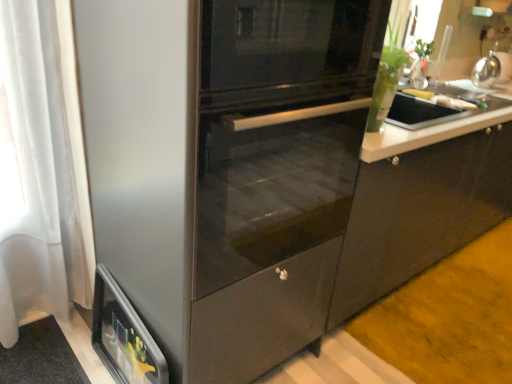
Question: Is yellow matte banana at upper right, the 1th food when ordered from back to front, not inside satin silver kettle at upper right?

Choices:
 (A) yes
 (B) no

Answer: (A)

Question: Does yellow matte banana at upper right, the 1th food when ordered from back to front, have a greater width compared to satin silver kettle at upper right?

Choices:
 (A) no
 (B) yes

Answer: (A)

Question: Is yellow matte banana at upper right, which is counted as the second food, starting from the front, beside satin silver kettle at upper right?

Choices:
 (A) yes
 (B) no

Answer: (B)

Question: From a real-world perspective, is yellow matte banana at upper right, the 1th food when ordered from back to front, positioned over satin silver kettle at upper right based on gravity?

Choices:
 (A) no
 (B) yes

Answer: (A)

Question: Considering the relative positions of yellow matte banana at upper right, which is counted as the second food, starting from the front, and satin silver kettle at upper right in the image provided, is yellow matte banana at upper right, which is counted as the second food, starting from the front, to the left of satin silver kettle at upper right from the viewer's perspective?

Choices:
 (A) yes
 (B) no

Answer: (A)

Question: Relative to stainless steel fridge at center, is metallic silver toaster at lower left in front or behind?

Choices:
 (A) behind
 (B) front

Answer: (A)

Question: In terms of size, does metallic silver toaster at lower left appear bigger or smaller than stainless steel fridge at center?

Choices:
 (A) small
 (B) big

Answer: (A)

Question: Do you think metallic silver toaster at lower left is within stainless steel fridge at center, or outside of it?

Choices:
 (A) inside
 (B) outside

Answer: (B)

Question: From a real-world perspective, is metallic silver toaster at lower left above or below stainless steel fridge at center?

Choices:
 (A) above
 (B) below

Answer: (B)

Question: From the image's perspective, is white glossy plate at upper right, positioned as the second food in back-to-front order, above or below stainless steel fridge at center?

Choices:
 (A) above
 (B) below

Answer: (A)

Question: Is point (458, 104) closer or farther from the camera than point (110, 256)?

Choices:
 (A) closer
 (B) farther

Answer: (B)

Question: Is white glossy plate at upper right, positioned as the second food in back-to-front order, taller or shorter than stainless steel fridge at center?

Choices:
 (A) short
 (B) tall

Answer: (A)

Question: Is white glossy plate at upper right, positioned as the second food in back-to-front order, bigger or smaller than stainless steel fridge at center?

Choices:
 (A) small
 (B) big

Answer: (A)

Question: Considering the positions of point (308, 127) and point (492, 56), is point (308, 127) closer or farther from the camera than point (492, 56)?

Choices:
 (A) closer
 (B) farther

Answer: (A)

Question: Is stainless steel fridge at center to the left or to the right of satin silver kettle at upper right in the image?

Choices:
 (A) right
 (B) left

Answer: (B)